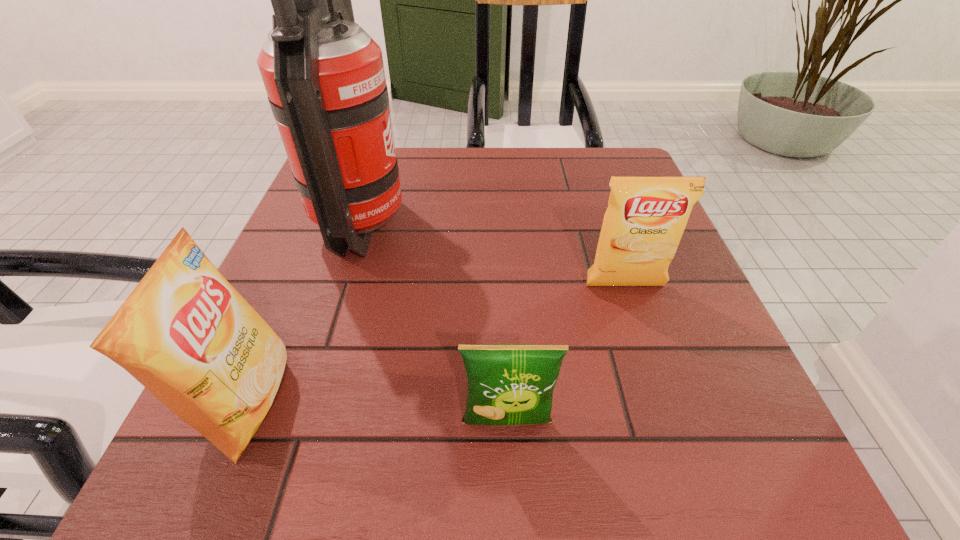
Locate an element on the screen. free space between the rightmost crisp (potato chip) and the leftmost crisp (potato chip) is located at coordinates (437, 344).

Image resolution: width=960 pixels, height=540 pixels. I want to click on the closest object to the leftmost crisp (potato chip), so click(324, 75).

Find the location of `object that is the closest to the second crisp (potato chip) from left to right`. object that is the closest to the second crisp (potato chip) from left to right is located at coordinates (642, 227).

At what (x,y) coordinates should I click in order to perform the action: click on crisp (potato chip) identified as the closest to the second crisp (potato chip) from right to left. Please return your answer as a coordinate pair (x, y). Looking at the image, I should click on coord(642,227).

Select which crisp (potato chip) is the third closest to the tallest object. Please provide its 2D coordinates. Your answer should be formatted as a tuple, i.e. [(x, y)], where the tuple contains the x and y coordinates of a point satisfying the conditions above.

[(642, 227)]